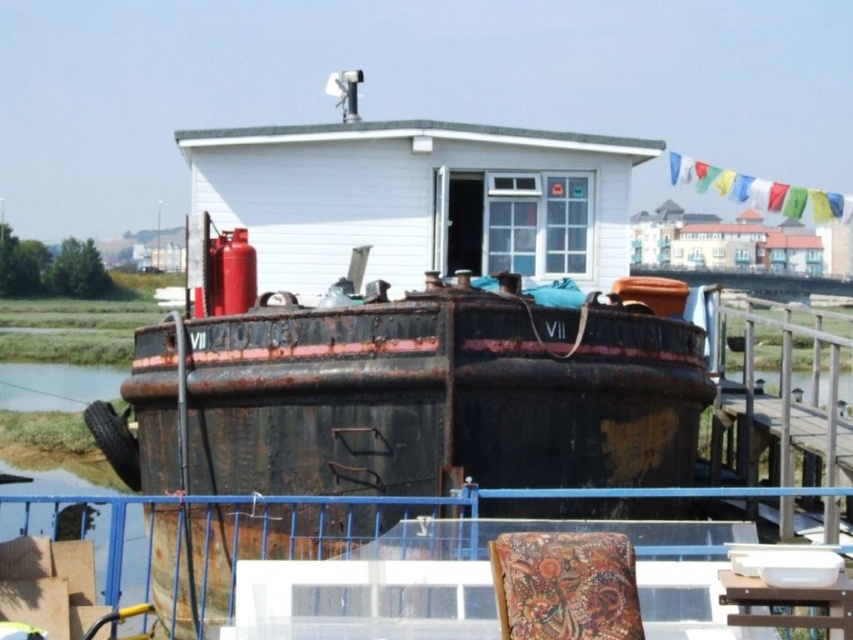
In the scene shown: Does patterned fabric chair at lower center appear over wooden table at lower right?

Yes, patterned fabric chair at lower center is above wooden table at lower right.

Can you confirm if patterned fabric chair at lower center is positioned to the right of wooden table at lower right?

Incorrect, patterned fabric chair at lower center is not on the right side of wooden table at lower right.

At what (x,y) coordinates should I click in order to perform the action: click on patterned fabric chair at lower center. Please return your answer as a coordinate pair (x, y). The width and height of the screenshot is (853, 640). Looking at the image, I should click on (566, 586).